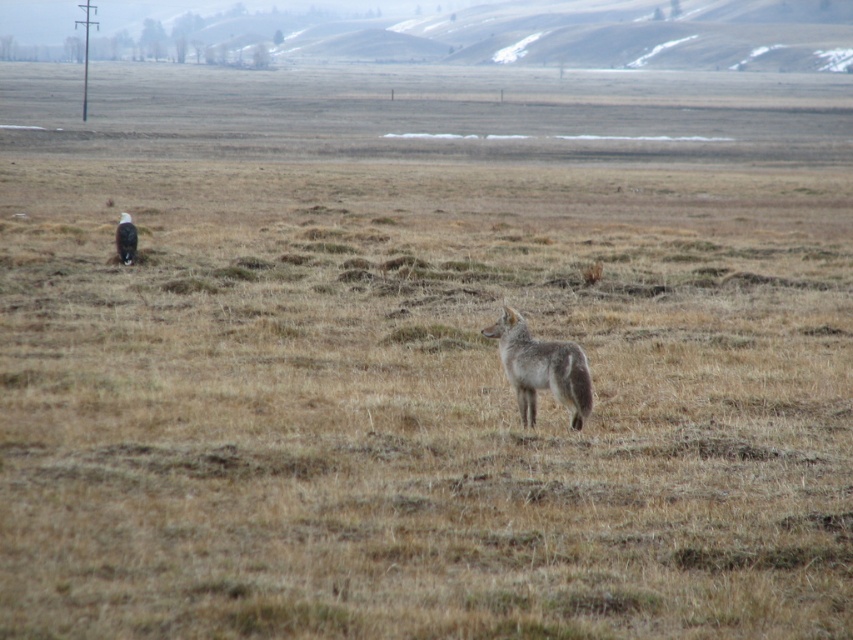
Is fur-like coyote at center in front of brown fur coyote at left?

Yes.

From the picture: Can you confirm if fur-like coyote at center is thinner than brown fur coyote at left?

In fact, fur-like coyote at center might be wider than brown fur coyote at left.

This screenshot has width=853, height=640. What do you see at coordinates (541, 369) in the screenshot?
I see `fur-like coyote at center` at bounding box center [541, 369].

At what (x,y) coordinates should I click in order to perform the action: click on fur-like coyote at center. Please return your answer as a coordinate pair (x, y). Looking at the image, I should click on (541, 369).